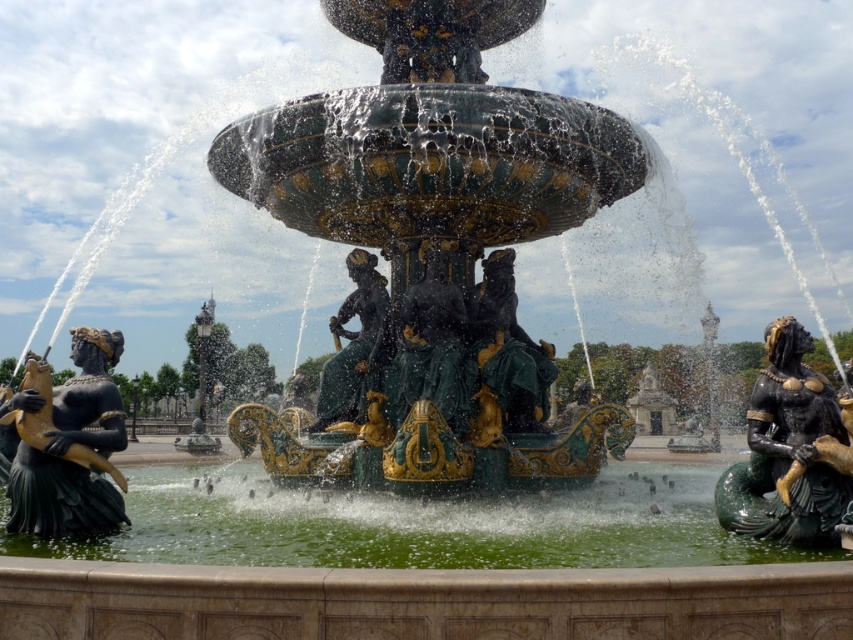
Question: Which of the following is the farthest from the observer?

Choices:
 (A) gold polished statue at center
 (B) black polished mermaid at right
 (C) black polished statue at left

Answer: (A)

Question: Which point appears farthest from the camera in this image?

Choices:
 (A) (355, 276)
 (B) (47, 397)
 (C) (442, 323)

Answer: (A)

Question: Among these objects, which one is farthest from the camera?

Choices:
 (A) black polished statue at left
 (B) gold polished statue at center
 (C) black polished mermaid at right

Answer: (B)

Question: Is black polished statue at left in front of green patina statue at center?

Choices:
 (A) no
 (B) yes

Answer: (B)

Question: Can you confirm if green patina statue at center is positioned above gold polished statue at center?

Choices:
 (A) no
 (B) yes

Answer: (A)

Question: Is black polished statue at left further to camera compared to gold polished statue at center?

Choices:
 (A) no
 (B) yes

Answer: (A)